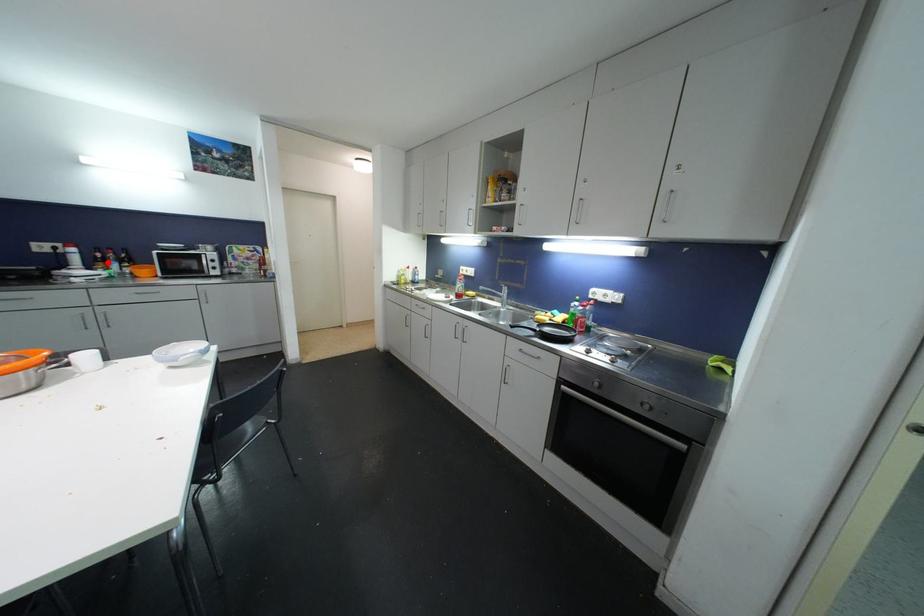
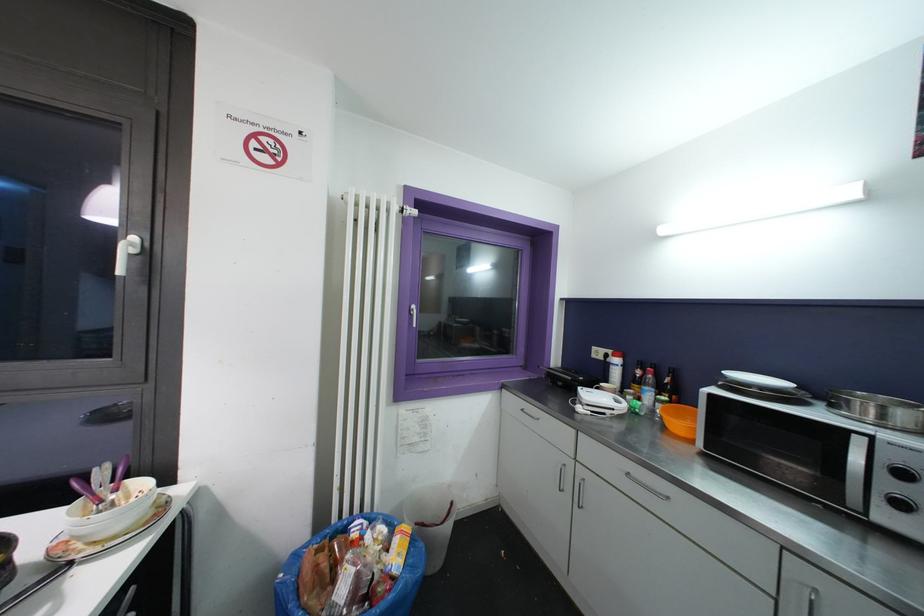
Find the pixel in the second image that matches the highlighted location in the first image.

(642, 385)